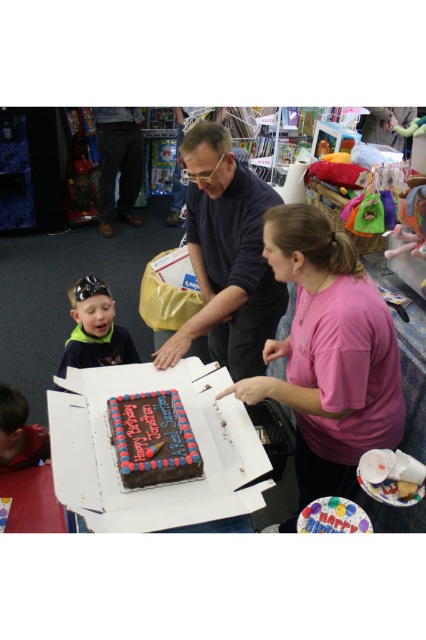
Is point (336, 413) in front of point (28, 412)?

Yes.

Who is more distant from viewer, (331, 250) or (37, 452)?

Point (37, 452)

Locate an element on the screen. This screenshot has width=426, height=640. pink matte shirt at center is located at coordinates (328, 355).

How much distance is there between pink matte shirt at center and green jersey at left?

pink matte shirt at center is 3.37 feet from green jersey at left.

Does pink matte shirt at center have a lesser width compared to green jersey at left?

Incorrect, pink matte shirt at center's width is not less than green jersey at left's.

Is point (339, 419) closer to camera compared to point (78, 339)?

Yes, it is.

Image resolution: width=426 pixels, height=640 pixels. Identify the location of pink matte shirt at center. (328, 355).

What do you see at coordinates (66, 291) in the screenshot? I see `matte cardboard box at center` at bounding box center [66, 291].

You are a GUI agent. You are given a task and a screenshot of the screen. Output one action in this format:
    pyautogui.click(x=<x>, y=<y>)
    Task: Click on the matte cardboard box at center
    Image resolution: width=426 pixels, height=640 pixels.
    Given the screenshot: What is the action you would take?
    pyautogui.click(x=66, y=291)

This screenshot has height=640, width=426. What are the coordinates of `matte cardboard box at center` in the screenshot? It's located at (66, 291).